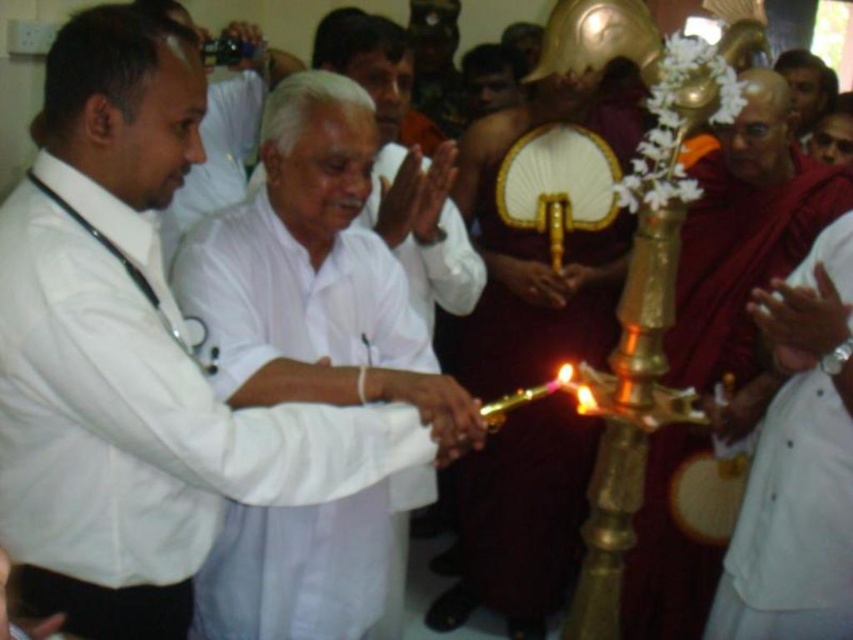
You are an observer in the temple. You notice the white matte shirt at center and the shiny gold ceremonial staff at center. Which object is closer to you?

The white matte shirt at center is closer to you because it is in front of the shiny gold ceremonial staff at center.

In the scene shown: You are a photographer positioned at the point marked by the coordinates point (x=541, y=244). You want to capture a photo of the shiny gold ceremonial staff at center. Given your position, can you see the shiny gold ceremonial staff at center clearly in your frame?

Yes, the point (x=541, y=244) indicates the shiny gold ceremonial staff at center, so you are positioned exactly at the staff. However, since you are at the same location as the staff, you would not be able to see it in your frame as you cannot look at yourself directly.

You are an observer in the temple. You notice the white matte shirt at center and the shiny gold ceremonial staff at center. Which object takes up more space in the scene?

The shiny gold ceremonial staff at center takes up more space in the scene because it is larger than the white matte shirt at center.